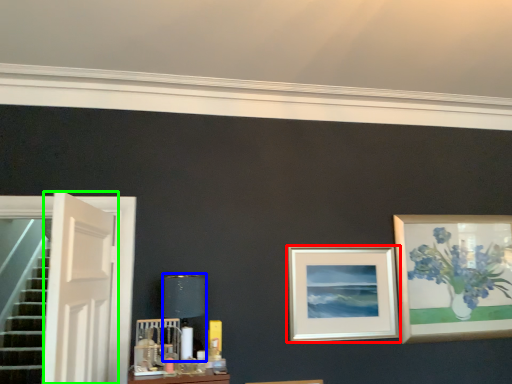
Question: Based on their relative distances, which object is nearer to picture frame (highlighted by a red box)? Choose from table lamp (highlighted by a blue box) and door (highlighted by a green box).

Choices:
 (A) table lamp
 (B) door

Answer: (A)